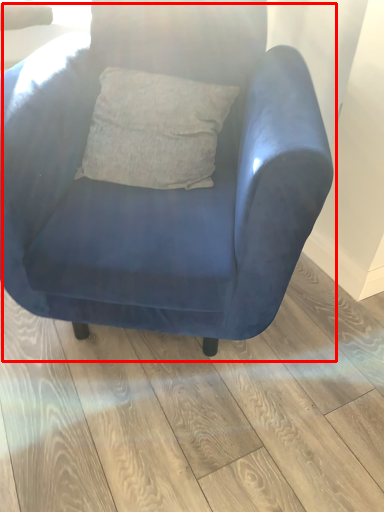
Question: Where is chair (annotated by the red box) located in relation to plank in the image?

Choices:
 (A) left
 (B) right

Answer: (A)